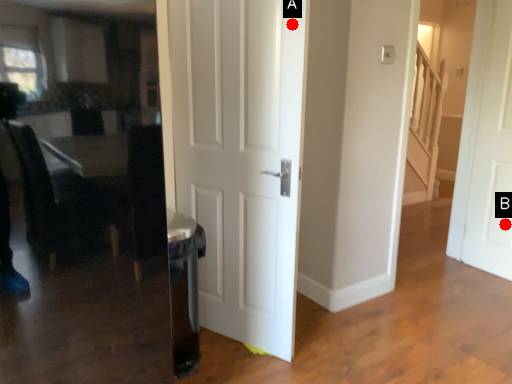
Question: Two points are circled on the image, labeled by A and B beside each circle. Which point is farther from the camera taking this photo?

Choices:
 (A) A is further
 (B) B is further

Answer: (B)